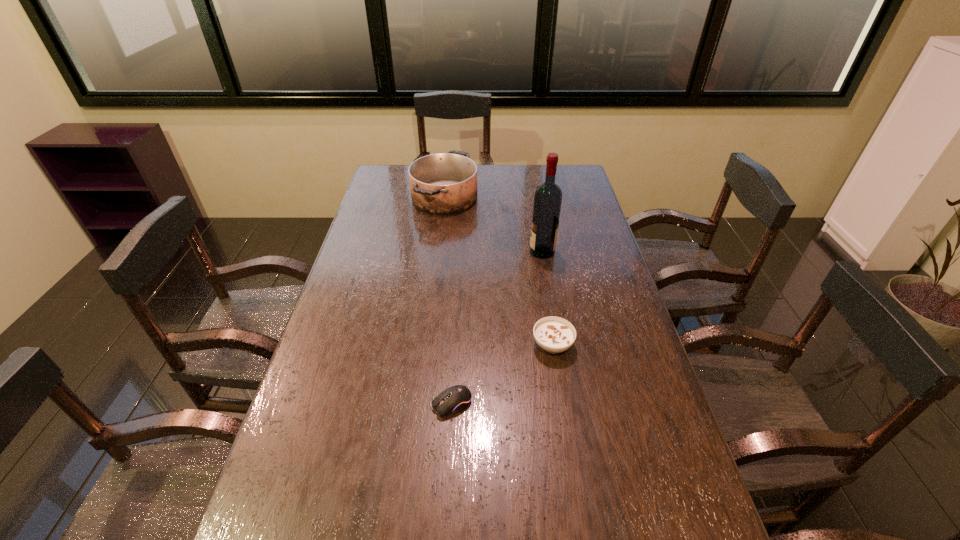
The width and height of the screenshot is (960, 540). In order to click on free location located 0.250m on the front and back of the third nearest object in this screenshot , I will do `click(458, 252)`.

Find the location of `vacant space positioned 0.170m on the left of the farthest object`. vacant space positioned 0.170m on the left of the farthest object is located at coordinates click(x=371, y=197).

At what (x,y) coordinates should I click in order to perform the action: click on vacant position located 0.050m on the back of the soup bowl. Please return your answer as a coordinate pair (x, y). This screenshot has height=540, width=960. Looking at the image, I should click on (548, 317).

The image size is (960, 540). What are the coordinates of `free space located 0.150m on the left of the shortest object` in the screenshot? It's located at (372, 403).

I want to click on object located at the far edge, so click(445, 183).

Where is `blank space at the far edge of the desktop`? Image resolution: width=960 pixels, height=540 pixels. blank space at the far edge of the desktop is located at coordinates (523, 173).

Identify the location of free location at the left edge. (359, 284).

Where is `blank area at the right edge`? The height and width of the screenshot is (540, 960). blank area at the right edge is located at coordinates pos(615,285).

This screenshot has width=960, height=540. I want to click on vacant space at the far left corner of the desktop, so (x=407, y=187).

Where is `vacant region at the far right corner of the desktop`? The image size is (960, 540). vacant region at the far right corner of the desktop is located at coordinates (559, 172).